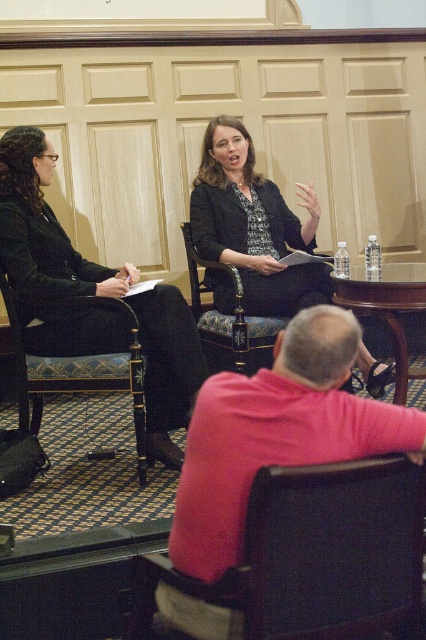
You are a guest entering the room and want to sit down. The host points to the carved wood chair at center and the matte black blazer at center. Which object is closer to you?

The carved wood chair at center is behind the matte black blazer at center, so the matte black blazer at center is closer to you.

You are standing in front of the panelled wall and see two points marked on the wall. The first point is at coordinates point [54,376] and the second is at point [250,342]. Which point is nearer to you?

Point [54,376] is closer to the viewer than point [250,342], so the first point is nearer to you.

From the picture: You are a photographer adjusting your camera to focus on two specific points in the scene. The first point is at coordinate point (224, 608) and the second is at point (193, 288). Which point should you focus on first if you want to ensure the closest object is in focus?

Point (224, 608) is closer to the camera than point (193, 288), so you should focus on point (224, 608) first to ensure the closest object is in focus.